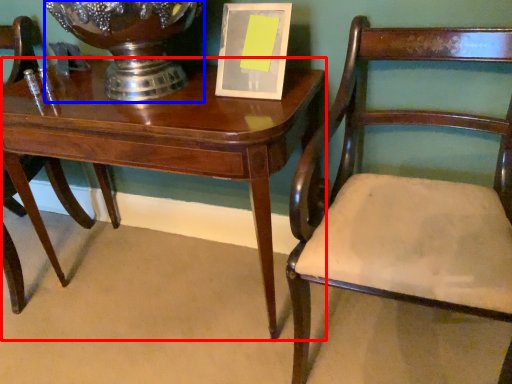
Question: Which object is closer to the camera taking this photo, table (highlighted by a red box) or glass vase (highlighted by a blue box)?

Choices:
 (A) table
 (B) glass vase

Answer: (B)